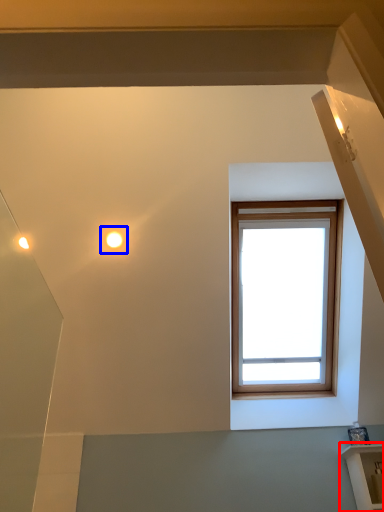
Question: Among these objects, which one is farthest to the camera, shelf (highlighted by a red box) or droplight (highlighted by a blue box)?

Choices:
 (A) shelf
 (B) droplight

Answer: (B)